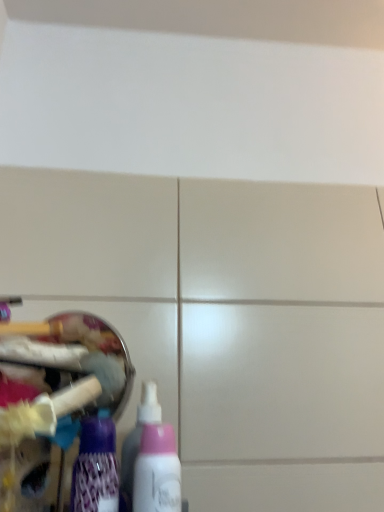
Question: From the image's perspective, is pink plastic bottle at lower left, which ranks as the 3th bottle in left-to-right order, above purple glossy bottle at lower left, positioned as the 1th bottle in left-to-right order?

Choices:
 (A) yes
 (B) no

Answer: (B)

Question: Is pink plastic bottle at lower left, which ranks as the 3th bottle in left-to-right order, taller than purple glossy bottle at lower left, positioned as the 1th bottle in left-to-right order?

Choices:
 (A) no
 (B) yes

Answer: (B)

Question: Is pink plastic bottle at lower left, which ranks as the 3th bottle in left-to-right order, at the right side of purple glossy bottle at lower left, positioned as the 1th bottle in left-to-right order?

Choices:
 (A) no
 (B) yes

Answer: (B)

Question: Is pink plastic bottle at lower left, which ranks as the 3th bottle in left-to-right order, aimed at purple glossy bottle at lower left, the third bottle positioned from the right?

Choices:
 (A) yes
 (B) no

Answer: (B)

Question: Is pink plastic bottle at lower left, which ranks as the 3th bottle in left-to-right order, turned away from purple glossy bottle at lower left, the third bottle positioned from the right?

Choices:
 (A) no
 (B) yes

Answer: (A)

Question: Considering the positions of pink matte bottle at lower left, placed as the second bottle when sorted from right to left, and purple glossy bottle at lower left, the third bottle positioned from the right, in the image, is pink matte bottle at lower left, placed as the second bottle when sorted from right to left, taller or shorter than purple glossy bottle at lower left, the third bottle positioned from the right,?

Choices:
 (A) tall
 (B) short

Answer: (A)

Question: Is pink matte bottle at lower left, the second bottle viewed from the left, wider or thinner than purple glossy bottle at lower left, positioned as the 1th bottle in left-to-right order?

Choices:
 (A) wide
 (B) thin

Answer: (A)

Question: Is pink matte bottle at lower left, the second bottle viewed from the left, to the left or to the right of purple glossy bottle at lower left, positioned as the 1th bottle in left-to-right order, in the image?

Choices:
 (A) right
 (B) left

Answer: (A)

Question: From a real-world perspective, is pink matte bottle at lower left, the second bottle viewed from the left, above or below purple glossy bottle at lower left, the third bottle positioned from the right?

Choices:
 (A) above
 (B) below

Answer: (A)

Question: Is pink matte bottle at lower left, the second bottle viewed from the left, wider or thinner than pink plastic bottle at lower left, the 1th bottle viewed from the right?

Choices:
 (A) wide
 (B) thin

Answer: (A)

Question: Is pink matte bottle at lower left, the second bottle viewed from the left, in front of or behind pink plastic bottle at lower left, which ranks as the 3th bottle in left-to-right order, in the image?

Choices:
 (A) behind
 (B) front

Answer: (A)

Question: In terms of size, does pink matte bottle at lower left, placed as the second bottle when sorted from right to left, appear bigger or smaller than pink plastic bottle at lower left, the 1th bottle viewed from the right?

Choices:
 (A) small
 (B) big

Answer: (A)

Question: Is point (132, 430) closer or farther from the camera than point (140, 489)?

Choices:
 (A) closer
 (B) farther

Answer: (B)

Question: Considering the positions of pink plastic bottle at lower left, the 1th bottle viewed from the right, and purple glossy bottle at lower left, positioned as the 1th bottle in left-to-right order, in the image, is pink plastic bottle at lower left, the 1th bottle viewed from the right, taller or shorter than purple glossy bottle at lower left, positioned as the 1th bottle in left-to-right order,?

Choices:
 (A) short
 (B) tall

Answer: (B)

Question: Visually, is pink plastic bottle at lower left, the 1th bottle viewed from the right, positioned to the left or to the right of purple glossy bottle at lower left, positioned as the 1th bottle in left-to-right order?

Choices:
 (A) right
 (B) left

Answer: (A)